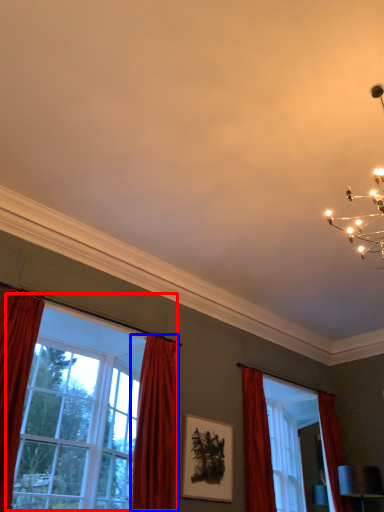
Question: Which object appears closest to the camera in this image, window (highlighted by a red box) or curtain (highlighted by a blue box)?

Choices:
 (A) window
 (B) curtain

Answer: (A)